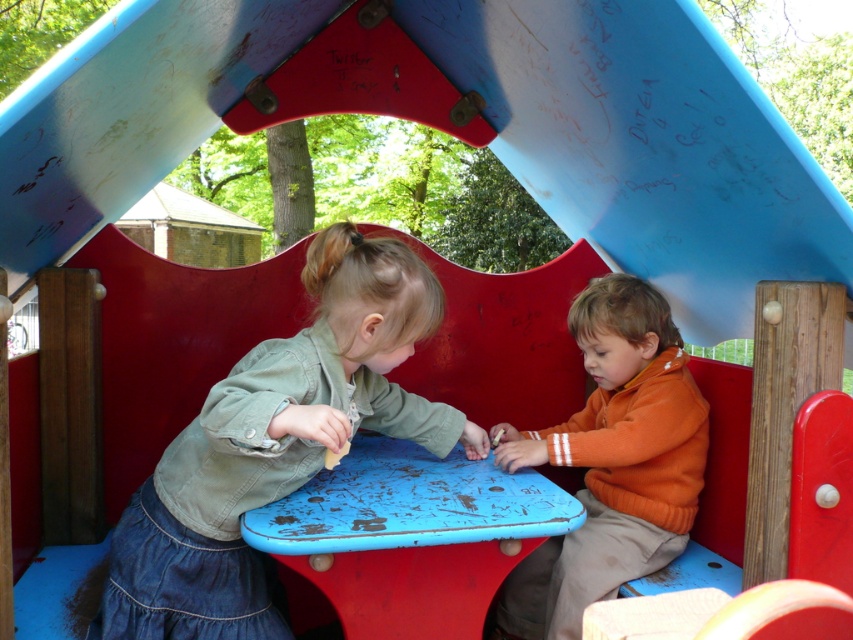
Question: Does denim jacket at left have a greater width compared to orange fleece sweater at center?

Choices:
 (A) no
 (B) yes

Answer: (B)

Question: Can you confirm if denim jacket at left is wider than orange fleece sweater at center?

Choices:
 (A) yes
 (B) no

Answer: (A)

Question: Can you confirm if denim jacket at left is positioned to the left of orange fleece sweater at center?

Choices:
 (A) yes
 (B) no

Answer: (A)

Question: Which of the following is the farthest from the observer?

Choices:
 (A) (323, 288)
 (B) (670, 528)

Answer: (B)